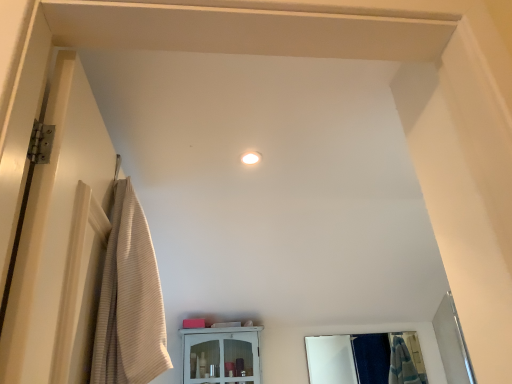
In order to face clear glass mirror at center, should I rotate leftwards or rightwards?

Turn right approximately 14.383 degrees to face it.

Measure the distance between white glossy cabinet at center and camera.

They are 6.30 feet apart.

You are a GUI agent. You are given a task and a screenshot of the screen. Output one action in this format:
    pyautogui.click(x=<x>, y=<y>)
    Task: Click on the clear glass mirror at center
    
    Given the screenshot: What is the action you would take?
    pyautogui.click(x=348, y=359)

Is white glossy cabinet at center placed right next to beige ribbed towel at left?

No, white glossy cabinet at center is not beside beige ribbed towel at left.

Considering the positions of objects white glossy cabinet at center and beige ribbed towel at left in the image provided, who is more to the right, white glossy cabinet at center or beige ribbed towel at left?

white glossy cabinet at center is more to the right.

From a real-world perspective, is white glossy cabinet at center physically below beige ribbed towel at left?

Indeed, from a real-world perspective, white glossy cabinet at center is positioned beneath beige ribbed towel at left.

Which is closer to the camera, (249, 381) or (121, 294)?

Positioned in front is point (121, 294).

Considering the relative sizes of clear glass mirror at center and white glossy cabinet at center in the image provided, is clear glass mirror at center shorter than white glossy cabinet at center?

No.

Find the location of a particular element. The image size is (512, 384). cabinetry located above the clear glass mirror at center (from a real-world perspective) is located at coordinates (221, 355).

Does clear glass mirror at center lie behind white glossy cabinet at center?

That is True.

Is clear glass mirror at center turned away from white glossy cabinet at center?

clear glass mirror at center does not have its back to white glossy cabinet at center.

Considering the relative sizes of beige ribbed towel at left and clear glass mirror at center in the image provided, is beige ribbed towel at left taller than clear glass mirror at center?

Correct, beige ribbed towel at left is much taller as clear glass mirror at center.

In terms of width, does beige ribbed towel at left look wider or thinner when compared to clear glass mirror at center?

Considering their sizes, beige ribbed towel at left looks broader than clear glass mirror at center.

Image resolution: width=512 pixels, height=384 pixels. What are the coordinates of `curtain on the left of clear glass mirror at center` in the screenshot? It's located at (129, 301).

Who is smaller, beige ribbed towel at left or clear glass mirror at center?

clear glass mirror at center is smaller.

From a real-world perspective, between beige ribbed towel at left and white glossy cabinet at center, who is vertically lower?

white glossy cabinet at center is physically lower.

Considering the sizes of beige ribbed towel at left and white glossy cabinet at center in the image, is beige ribbed towel at left taller or shorter than white glossy cabinet at center?

Clearly, beige ribbed towel at left is taller compared to white glossy cabinet at center.

In order to click on cabinetry that appears on the right of beige ribbed towel at left in this screenshot , I will do `click(221, 355)`.

From a real-world perspective, is white glossy cabinet at center physically above clear glass mirror at center?

Yes, from a real-world perspective, white glossy cabinet at center is on top of clear glass mirror at center.

Identify the location of cabinetry above the clear glass mirror at center (from a real-world perspective). (221, 355).

Does white glossy cabinet at center turn towards clear glass mirror at center?

No.

Is white glossy cabinet at center not inside clear glass mirror at center?

Absolutely, white glossy cabinet at center is external to clear glass mirror at center.

Are clear glass mirror at center and beige ribbed towel at left making contact?

There is a gap between clear glass mirror at center and beige ribbed towel at left.

You are a GUI agent. You are given a task and a screenshot of the screen. Output one action in this format:
    pyautogui.click(x=<x>, y=<y>)
    Task: Click on the curtain that is on the left side of clear glass mirror at center
    
    Given the screenshot: What is the action you would take?
    pyautogui.click(x=129, y=301)

Considering the sizes of clear glass mirror at center and beige ribbed towel at left in the image, is clear glass mirror at center bigger or smaller than beige ribbed towel at left?

Considering their sizes, clear glass mirror at center takes up less space than beige ribbed towel at left.

Is clear glass mirror at center taller than beige ribbed towel at left?

In fact, clear glass mirror at center may be shorter than beige ribbed towel at left.

You are a GUI agent. You are given a task and a screenshot of the screen. Output one action in this format:
    pyautogui.click(x=<x>, y=<y>)
    Task: Click on the curtain on the left side of white glossy cabinet at center
    
    Given the screenshot: What is the action you would take?
    pyautogui.click(x=129, y=301)

Identify the location of cabinetry lying in front of the clear glass mirror at center. (221, 355).

When comparing their distances from white glossy cabinet at center, does beige ribbed towel at left or clear glass mirror at center seem further?

clear glass mirror at center.

In the scene shown: From the image, which object appears to be nearer to clear glass mirror at center, beige ribbed towel at left or white glossy cabinet at center?

Based on the image, white glossy cabinet at center appears to be nearer to clear glass mirror at center.

Estimate the real-world distances between objects in this image. Which object is closer to beige ribbed towel at left, clear glass mirror at center or white glossy cabinet at center?

white glossy cabinet at center.

Considering their positions, is clear glass mirror at center positioned further to white glossy cabinet at center than beige ribbed towel at left?

Based on the image, clear glass mirror at center appears to be further to white glossy cabinet at center.

Which object lies further to the anchor point clear glass mirror at center, white glossy cabinet at center or beige ribbed towel at left?

Based on the image, beige ribbed towel at left appears to be further to clear glass mirror at center.

Looking at the image, which one is located closer to beige ribbed towel at left, white glossy cabinet at center or clear glass mirror at center?

The object closer to beige ribbed towel at left is white glossy cabinet at center.

Identify the location of cabinetry between beige ribbed towel at left and clear glass mirror at center from front to back. This screenshot has height=384, width=512. (221, 355).